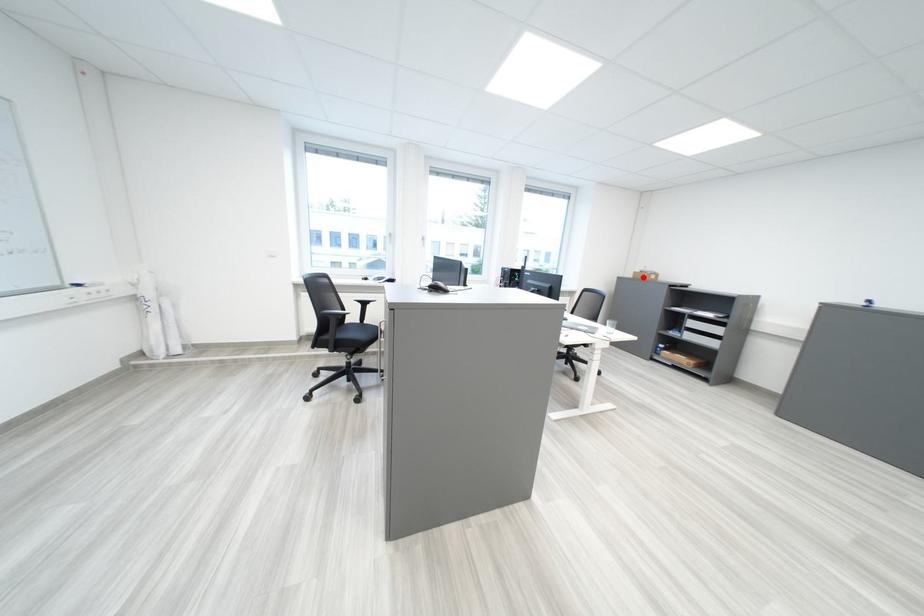
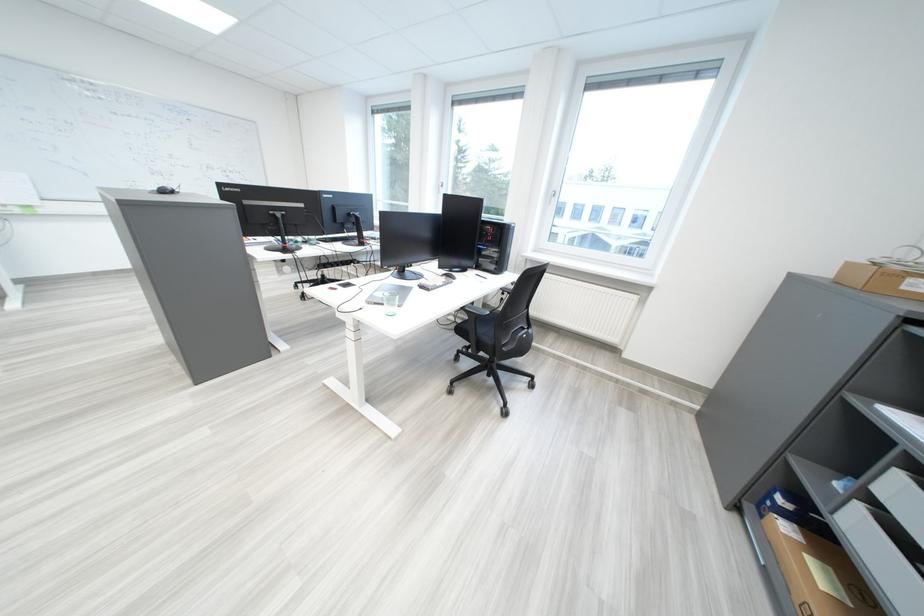
Question: I am providing you with two images of the same scene from different viewpoints. Given a red point in image1, look at the same physical point in image2. Is it:

Choices:
 (A) Closer to the viewpoint
 (B) Farther from the viewpoint

Answer: (B)